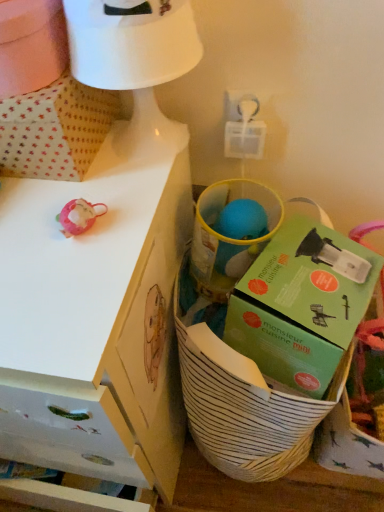
This screenshot has width=384, height=512. What are the coordinates of `free space underneath white matte table lamp at upper center (from a real-world perspective)` in the screenshot? It's located at (149, 148).